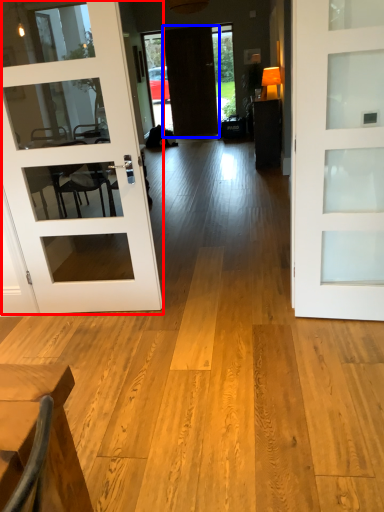
Question: Which object is further to the camera taking this photo, door (highlighted by a red box) or door (highlighted by a blue box)?

Choices:
 (A) door
 (B) door

Answer: (B)